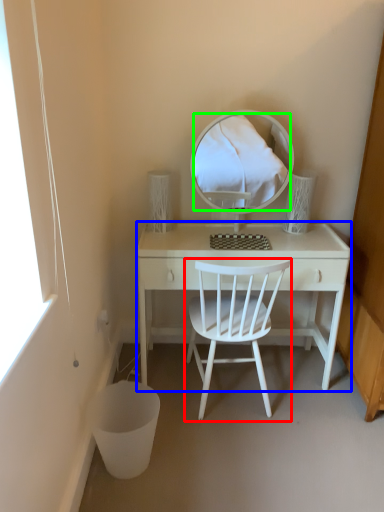
Question: Considering the real-world distances, which object is closest to chair (highlighted by a red box)? desk (highlighted by a blue box) or mirror (highlighted by a green box).

Choices:
 (A) desk
 (B) mirror

Answer: (A)